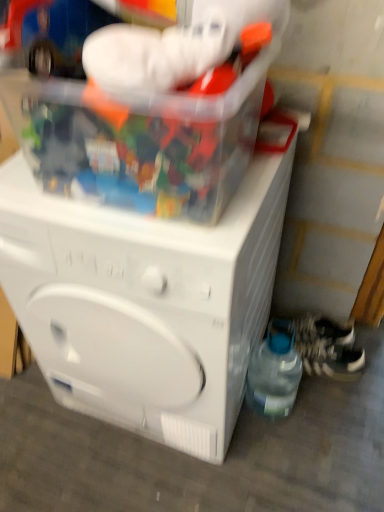
The width and height of the screenshot is (384, 512). I want to click on free point in front of transparent plastic bottle at lower right, so click(276, 454).